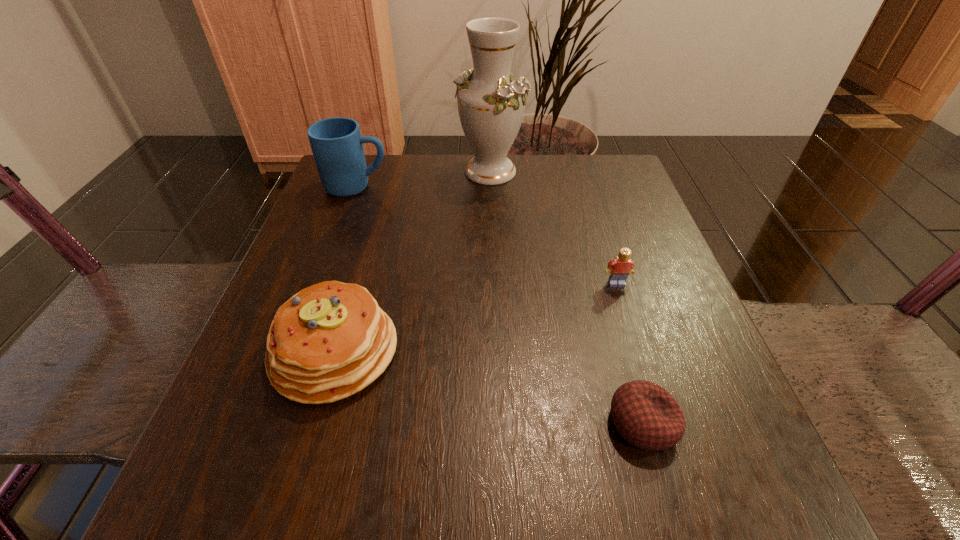
Locate an element on the screen. Image resolution: width=960 pixels, height=540 pixels. the third object from left to right is located at coordinates click(x=491, y=104).

Identify the location of the tallest object. (491, 104).

Where is `mug`? mug is located at coordinates (337, 145).

This screenshot has height=540, width=960. What are the coordinates of `the third tallest object` in the screenshot? It's located at (329, 341).

Locate an element on the screen. The width and height of the screenshot is (960, 540). the fourth tallest object is located at coordinates (619, 268).

Image resolution: width=960 pixels, height=540 pixels. What are the coordinates of `the third nearest object` in the screenshot? It's located at (619, 268).

The image size is (960, 540). Find the location of `the shortest object`. the shortest object is located at coordinates (645, 414).

The height and width of the screenshot is (540, 960). Identify the location of vacant space located on the left of the third object from right to left. (387, 171).

You are a GUI agent. You are given a task and a screenshot of the screen. Output one action in this format:
    pyautogui.click(x=<x>, y=<y>)
    Task: Click on the vacant region located 0.230m on the side of the fourth shortest object with the handle
    
    Given the screenshot: What is the action you would take?
    pyautogui.click(x=487, y=187)

Where is `vacant region located 0.250m on the right of the third shortest object`? vacant region located 0.250m on the right of the third shortest object is located at coordinates (555, 351).